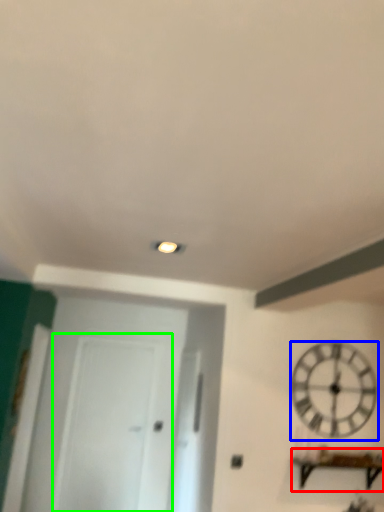
Question: Based on their relative distances, which object is nearer to furniture (highlighted by a red box)? Choose from wall clock (highlighted by a blue box) and glass door (highlighted by a green box).

Choices:
 (A) wall clock
 (B) glass door

Answer: (A)